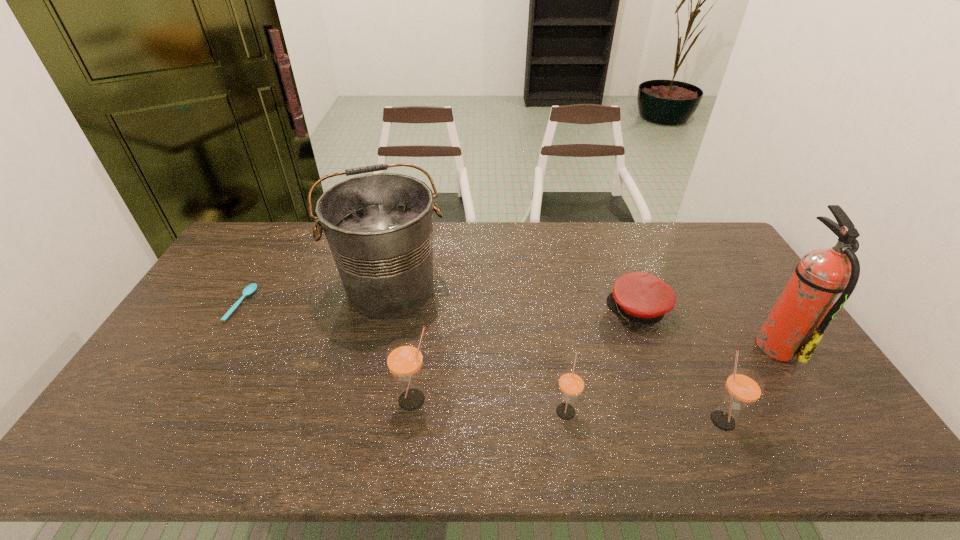
This screenshot has width=960, height=540. What are the coordinates of `the leftmost straw` in the screenshot? It's located at (404, 358).

Where is `the third shortest object`? Image resolution: width=960 pixels, height=540 pixels. the third shortest object is located at coordinates (571, 384).

At what (x,y) coordinates should I click in order to perform the action: click on the shortest straw. Please return your answer as a coordinate pair (x, y). Looking at the image, I should click on (571, 384).

Image resolution: width=960 pixels, height=540 pixels. I want to click on the fourth tallest object, so click(x=743, y=387).

Locate an element on the screen. The width and height of the screenshot is (960, 540). the second shortest straw is located at coordinates (743, 387).

Where is `bucket`? The image size is (960, 540). bucket is located at coordinates (379, 227).

Where is `the second shortest object`? The width and height of the screenshot is (960, 540). the second shortest object is located at coordinates (641, 298).

You are a GUI agent. You are given a task and a screenshot of the screen. Output one action in this format:
    pyautogui.click(x=<x>, y=<y>)
    Task: Click on the shortest object
    
    Given the screenshot: What is the action you would take?
    pyautogui.click(x=250, y=289)

Locate an element on the screen. The height and width of the screenshot is (540, 960). the leftmost object is located at coordinates (250, 289).

The height and width of the screenshot is (540, 960). I want to click on the rightmost object, so click(825, 278).